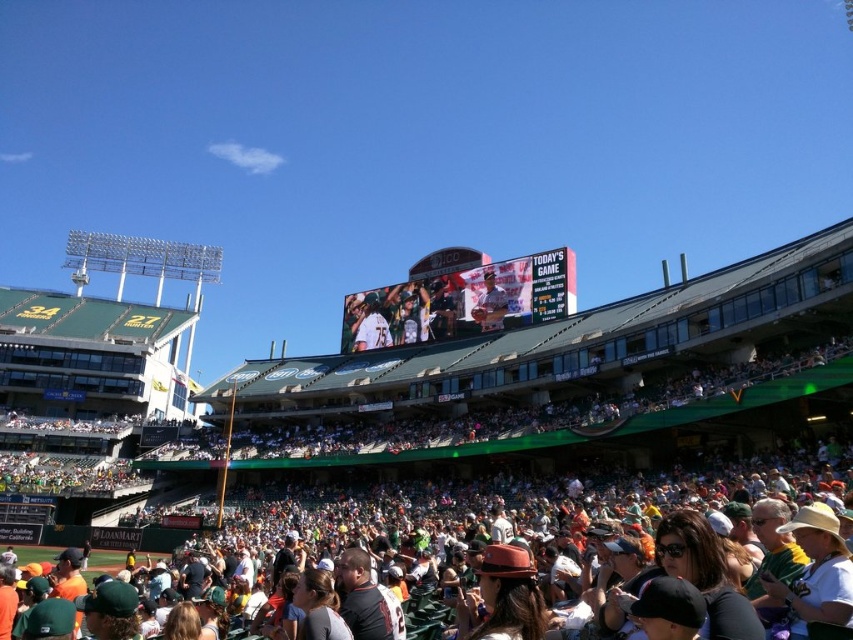
Question: Does white digital scoreboard at center appear on the left side of matte gray baseball cap at center?

Choices:
 (A) yes
 (B) no

Answer: (A)

Question: Can you confirm if white digital scoreboard at center is smaller than matte gray baseball cap at center?

Choices:
 (A) no
 (B) yes

Answer: (A)

Question: Which of the following is the closest to the observer?

Choices:
 (A) white digital scoreboard at center
 (B) matte gray baseball cap at center

Answer: (A)

Question: Among these objects, which one is nearest to the camera?

Choices:
 (A) matte gray baseball cap at center
 (B) white digital scoreboard at center

Answer: (B)

Question: Is white digital scoreboard at center thinner than matte gray baseball cap at center?

Choices:
 (A) yes
 (B) no

Answer: (B)